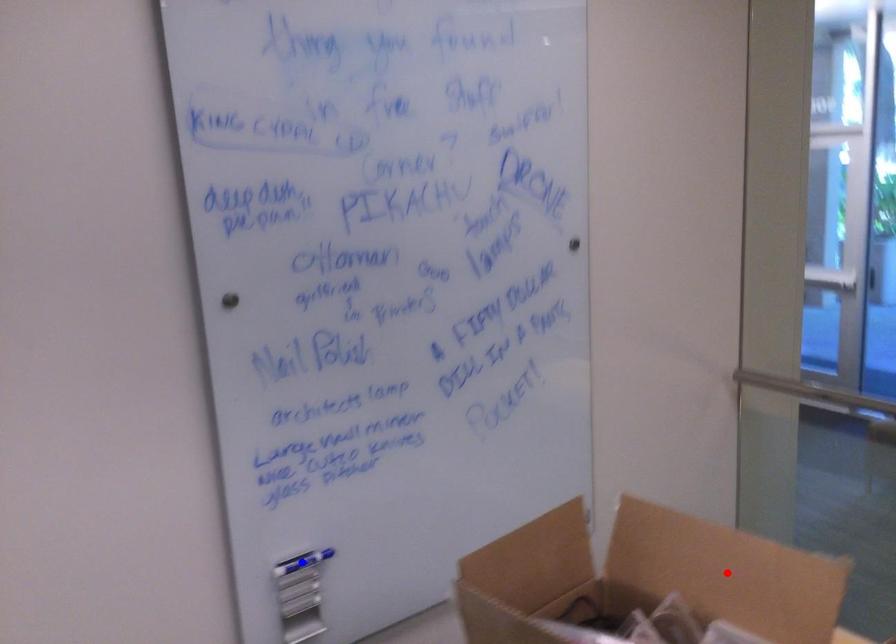
Question: Two points are marked on the image. Which point is closer to the camera?

Choices:
 (A) Blue point is closer.
 (B) Red point is closer.

Answer: (B)